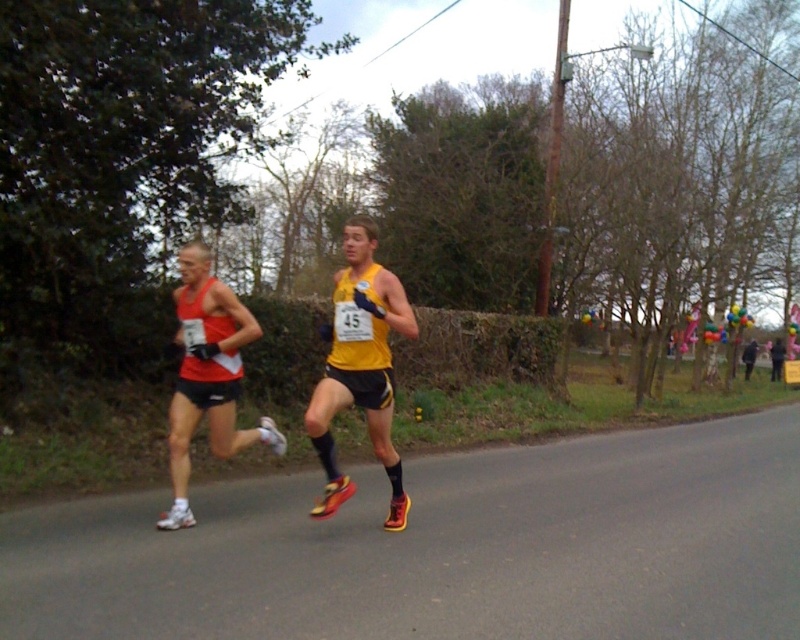
Question: Does yellow matte running shoe at center appear on the right side of black matte jacket at right?

Choices:
 (A) yes
 (B) no

Answer: (B)

Question: Which of the following is the farthest from the observer?

Choices:
 (A) (745, 372)
 (B) (393, 291)
 (C) (237, 380)

Answer: (A)

Question: Which object is the closest to the black matte jacket at right?

Choices:
 (A) yellow matte running shoe at center
 (B) matte red tank top at left

Answer: (B)

Question: Is yellow matte running shoe at center positioned at the back of matte red tank top at left?

Choices:
 (A) no
 (B) yes

Answer: (A)

Question: Among these points, which one is farthest from the camera?

Choices:
 (A) (356, 369)
 (B) (744, 358)
 (C) (272, 445)

Answer: (B)

Question: Does matte red tank top at left have a larger size compared to black matte jacket at right?

Choices:
 (A) yes
 (B) no

Answer: (A)